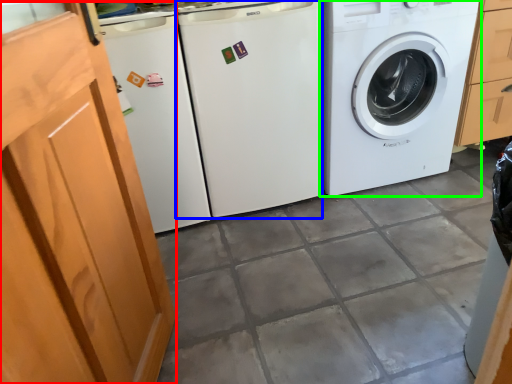
Question: Based on their relative distances, which object is nearer to screen door (highlighted by a red box)? Choose from washing machine (highlighted by a blue box) and washing machine (highlighted by a green box).

Choices:
 (A) washing machine
 (B) washing machine

Answer: (A)